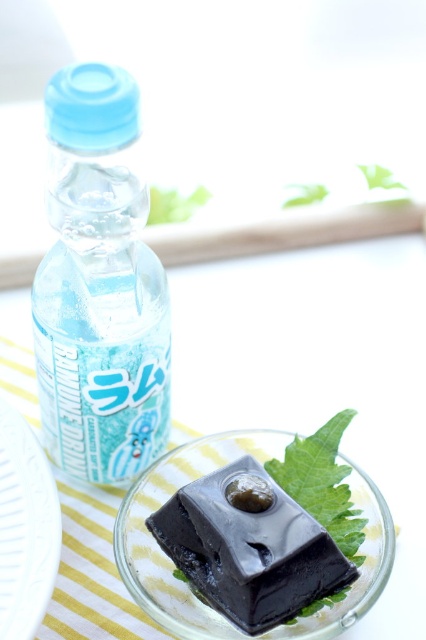
You are at a dessert counter and see the blue plastic bottle at left and the shiny dark chocolate at center. Which one is taller?

The blue plastic bottle at left is taller than the shiny dark chocolate at center.

In the scene shown: You are a food stylist arranging a dessert on a glass plate. You need to place a garnish exactly at the coordinates point (98, 285). However, the dessert is already occupying that spot. What should you do?

The point (98, 285) corresponds to the blue plastic bottle at left, so you cannot place the garnish there as it is occupied by the bottle.

You are a photographer trying to capture the dessert on the glass plate. The blue plastic bottle at left is in the background. If you want to frame the dessert without the bottle, which direction should you move the camera? Please answer with a direction like left, right, up, down, or a combination like up and left.

To avoid capturing the blue plastic bottle at left, move the camera to the right. Since the blue plastic bottle at left is located at point 0.447 on the x and 0.232 on the y coordinates, moving the camera to the right would shift the frame away from its position.